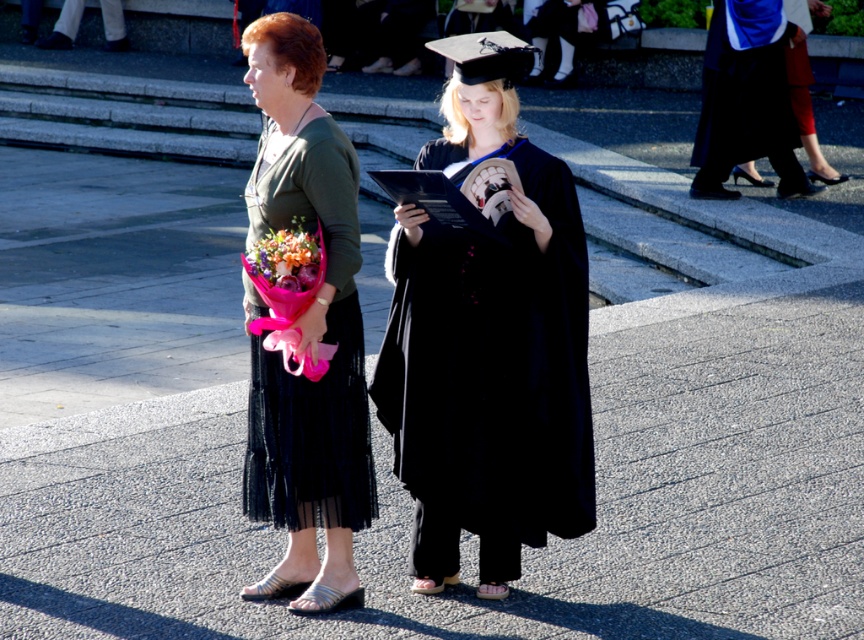
Question: Among these objects, which one is nearest to the camera?

Choices:
 (A) matte black graduation gown at center
 (B) matte green dress at center
 (C) blue satin robe at upper right

Answer: (A)

Question: Which is farther from the matte green dress at center?

Choices:
 (A) matte black graduation gown at center
 (B) blue satin robe at upper right

Answer: (B)

Question: Is matte black graduation gown at center wider than matte green dress at center?

Choices:
 (A) yes
 (B) no

Answer: (A)

Question: Is matte black graduation gown at center thinner than blue satin robe at upper right?

Choices:
 (A) yes
 (B) no

Answer: (A)

Question: In this image, where is matte black graduation gown at center located relative to matte green dress at center?

Choices:
 (A) above
 (B) below

Answer: (B)

Question: Among these objects, which one is nearest to the camera?

Choices:
 (A) matte black graduation gown at center
 (B) blue satin robe at upper right

Answer: (A)